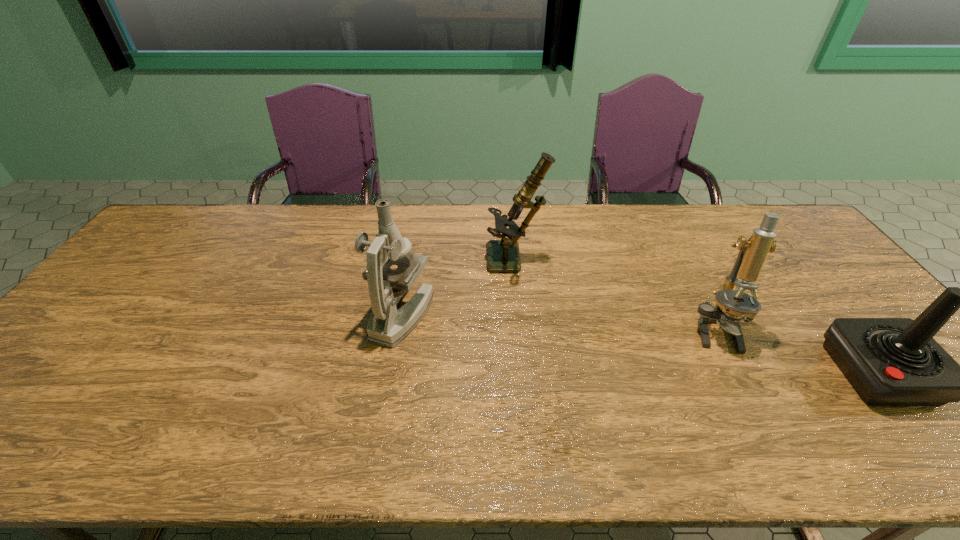
Locate an element on the screen. Image resolution: width=960 pixels, height=540 pixels. the leftmost object is located at coordinates (388, 325).

You are a GUI agent. You are given a task and a screenshot of the screen. Output one action in this format:
    pyautogui.click(x=<x>, y=<y>)
    Task: Click on the farthest microscope
    
    Given the screenshot: What is the action you would take?
    pyautogui.click(x=503, y=255)

Find the location of a particular element. This screenshot has height=540, width=960. the second object from left to right is located at coordinates (503, 255).

Where is `the second object from right to left`? The width and height of the screenshot is (960, 540). the second object from right to left is located at coordinates (727, 313).

Where is `joystick`? joystick is located at coordinates (889, 361).

Locate an element on the screen. The width and height of the screenshot is (960, 540). the rightmost object is located at coordinates click(x=889, y=361).

You are a GUI agent. You are given a task and a screenshot of the screen. Output one action in this format:
    pyautogui.click(x=<x>, y=<y>)
    Task: Click on the free space located 0.050m on the back of the leftmost microscope
    
    Given the screenshot: What is the action you would take?
    pyautogui.click(x=410, y=275)

Locate an element on the screen. vacant space situated at the eyepiece of the farthest microscope is located at coordinates (394, 261).

At what (x,y) coordinates should I click in order to perform the action: click on vacant space situated at the eyepiece of the farthest microscope. Please return your answer as a coordinate pair (x, y). The height and width of the screenshot is (540, 960). Looking at the image, I should click on (422, 261).

Locate an element on the screen. free space located at the eyepiece of the farthest microscope is located at coordinates (400, 261).